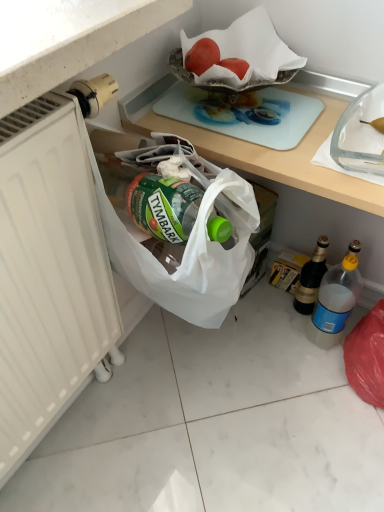
Question: In terms of width, does dark brown glass bottle at lower right, which is the second bottle in front-to-back order, look wider or thinner when compared to white matte tile at lower left?

Choices:
 (A) wide
 (B) thin

Answer: (A)

Question: Is dark brown glass bottle at lower right, which is the second bottle in front-to-back order, taller or shorter than white matte tile at lower left?

Choices:
 (A) tall
 (B) short

Answer: (A)

Question: Based on their relative distances, which object is nearer to the red matte tomato at upper center?

Choices:
 (A) dark brown glass bottle at lower right, the first bottle positioned from the back
 (B) blue plastic bottle at lower right, the first bottle viewed from the front
 (C) white matte radiator at left
 (D) light blue glass cutting board at upper center
 (E) white matte tile at lower left

Answer: (D)

Question: Based on their relative distances, which object is farther from the white matte radiator at left?

Choices:
 (A) dark brown glass bottle at lower right, which is the second bottle in front-to-back order
 (B) blue plastic bottle at lower right, the first bottle viewed from the front
 (C) white matte tile at lower left
 (D) red matte tomato at upper center
 (E) light blue glass cutting board at upper center

Answer: (A)